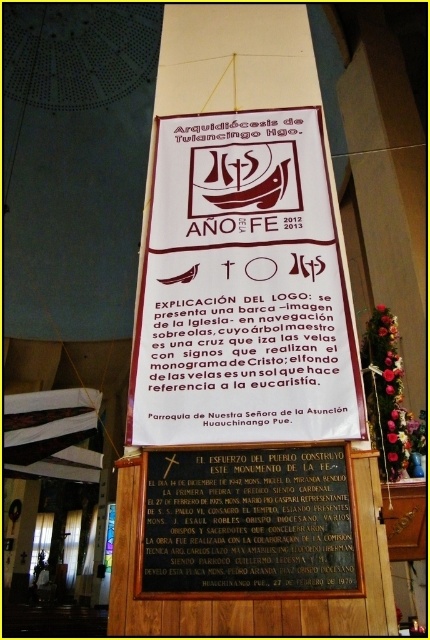
You are standing in the church and see the white paper banner at center and the black polished stone plaque at center. Which object is positioned to the left?

The white paper banner at center is to the left of the black polished stone plaque at center.

You are an interior designer planning to hang a new decoration in the space. You have to choose between placing it above the white paper banner at center or above the black polished stone plaque at center. Which one would allow for a larger decoration due to the available space above it?

The white paper banner at center is bigger than the black polished stone plaque at center, so placing a larger decoration above the white paper banner at center would be more appropriate as it occupies more space and likely has more vertical clearance.

You are standing in front of the banner in the church. There are two points marked on the banner. The first point is at coordinates point (134, 401) and the second is at point (175, 573). Which point is closer to you?

Point (175, 573) is closer to you because it is in front of point (134, 401).